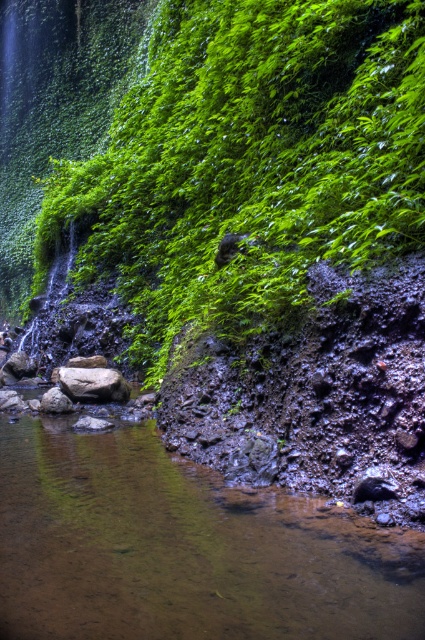
You are standing at the edge of the calm reflective water in the scene. You see the green leafy vegetation at left and the brown rough rock at center. Which object is higher in the scene?

The green leafy vegetation at left is above the brown rough rock at center, so it is higher in the scene.

You are a hiker trying to cross the stream shown in the image. You see a brown rock at lower left and a brown rough rock at center. Which rock is larger in size?

The brown rock at lower left is bigger than the brown rough rock at center according to the description.